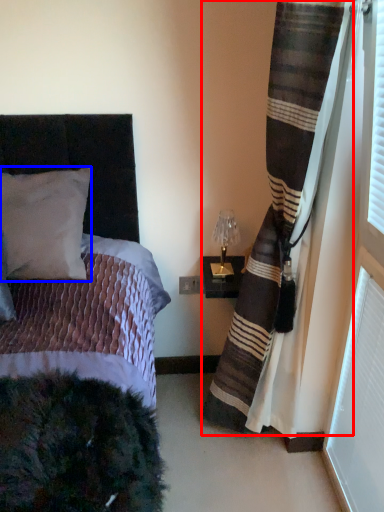
Question: Among these objects, which one is nearest to the camera, curtain (highlighted by a red box) or pillow (highlighted by a blue box)?

Choices:
 (A) curtain
 (B) pillow

Answer: (A)